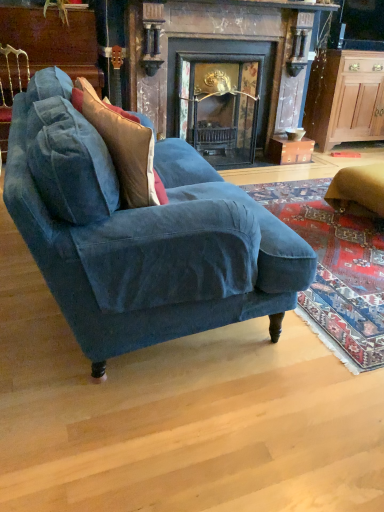
Question: Does velvet cushion at left appear on the right side of dark wood fireplace at center?

Choices:
 (A) no
 (B) yes

Answer: (A)

Question: Does velvet cushion at left have a lesser height compared to dark wood fireplace at center?

Choices:
 (A) yes
 (B) no

Answer: (A)

Question: Considering the relative positions of velvet cushion at left and dark wood fireplace at center in the image provided, is velvet cushion at left behind dark wood fireplace at center?

Choices:
 (A) no
 (B) yes

Answer: (A)

Question: From a real-world perspective, is velvet cushion at left located higher than dark wood fireplace at center?

Choices:
 (A) yes
 (B) no

Answer: (A)

Question: From the image's perspective, is velvet cushion at left above dark wood fireplace at center?

Choices:
 (A) yes
 (B) no

Answer: (B)

Question: Is velvet cushion at left bigger than dark wood fireplace at center?

Choices:
 (A) yes
 (B) no

Answer: (B)

Question: Could you tell me if velvet cushion at left is turned towards velvet blue couch at center?

Choices:
 (A) no
 (B) yes

Answer: (B)

Question: Is velvet blue couch at center completely or partially inside velvet cushion at left?

Choices:
 (A) yes
 (B) no

Answer: (B)

Question: Is velvet cushion at left with velvet blue couch at center?

Choices:
 (A) yes
 (B) no

Answer: (B)

Question: From the image's perspective, would you say velvet cushion at left is shown under velvet blue couch at center?

Choices:
 (A) yes
 (B) no

Answer: (B)

Question: Is velvet cushion at left not within velvet blue couch at center?

Choices:
 (A) yes
 (B) no

Answer: (B)

Question: Is velvet cushion at left far away from velvet blue couch at center?

Choices:
 (A) yes
 (B) no

Answer: (B)

Question: From a real-world perspective, is velvet cushion at left located beneath wooden cabinet at right?

Choices:
 (A) no
 (B) yes

Answer: (A)